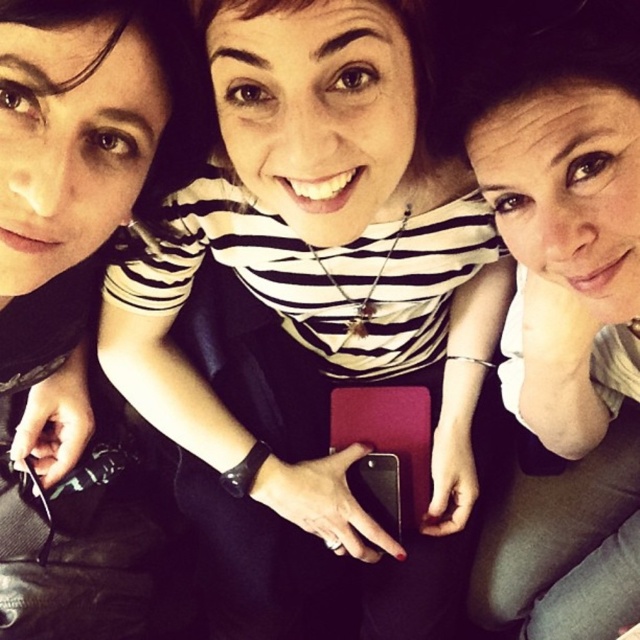
Which is above, matte black phone at center or matte black shirt at upper left?

matte black shirt at upper left is higher up.

Does matte black phone at center have a lesser width compared to matte black shirt at upper left?

No, matte black phone at center is not thinner than matte black shirt at upper left.

Is point (276, 84) positioned behind point (80, 445)?

No, (276, 84) is in front of (80, 445).

Identify the location of matte black phone at center. Image resolution: width=640 pixels, height=640 pixels. (330, 272).

Who is shorter, matte black phone at center or matte black shirt at center?

matte black shirt at center is shorter.

Is matte black phone at center taller than matte black shirt at center?

Indeed, matte black phone at center has a greater height compared to matte black shirt at center.

Which is behind, point (128, 266) or point (513, 74)?

The point (128, 266) is behind.

Identify the location of matte black phone at center. (330, 272).

Is matte black shirt at center taller than matte black shirt at upper left?

Correct, matte black shirt at center is much taller as matte black shirt at upper left.

Looking at this image, which of these two, matte black shirt at center or matte black shirt at upper left, stands taller?

With more height is matte black shirt at center.

This screenshot has height=640, width=640. Describe the element at coordinates (564, 317) in the screenshot. I see `matte black shirt at center` at that location.

Identify the location of matte black shirt at center. (564, 317).